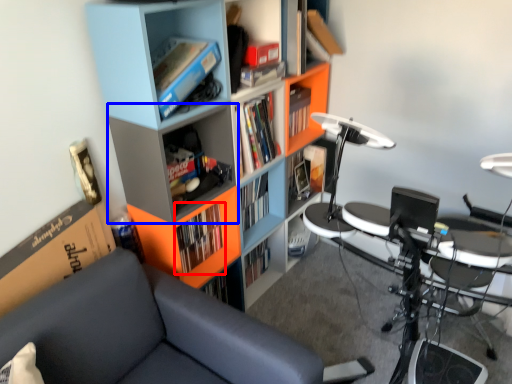
Question: Which object is closer to the camera taking this photo, book (highlighted by a red box) or shelf (highlighted by a blue box)?

Choices:
 (A) book
 (B) shelf

Answer: (B)